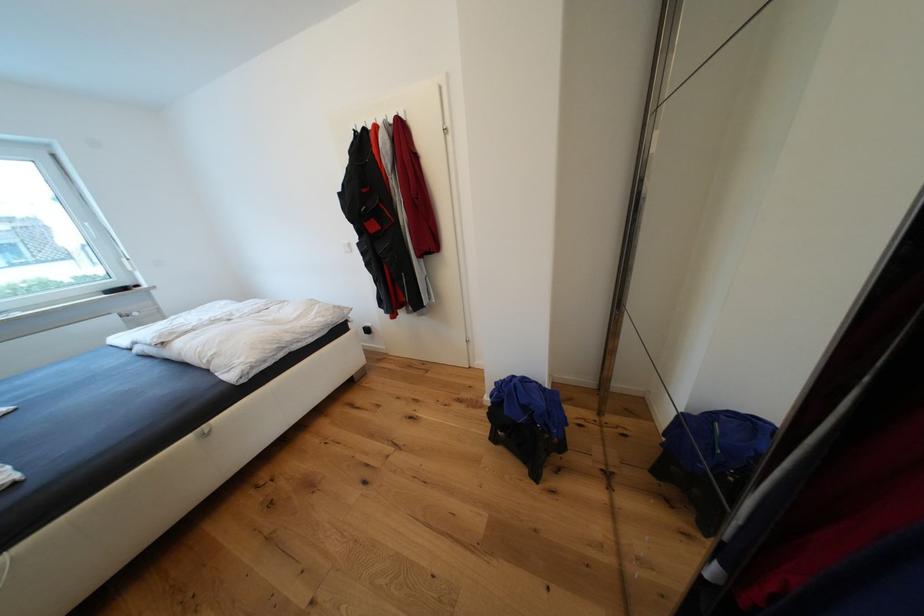
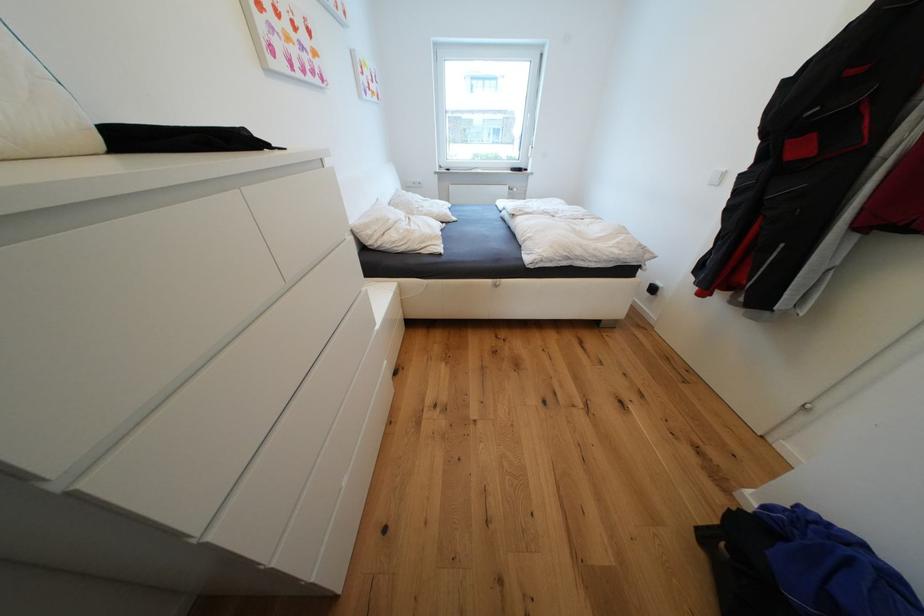
In the second image, find the point that corresponds to the point at 197,438 in the first image.

(496, 282)